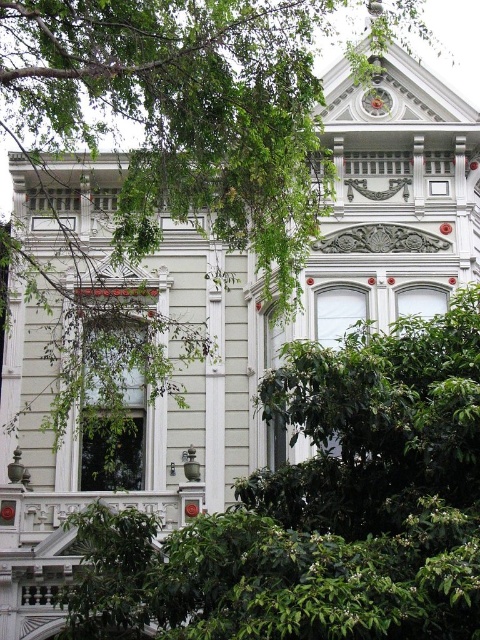
Question: Is the position of green leafy tree at left less distant than that of green leafy tree at center?

Choices:
 (A) no
 (B) yes

Answer: (B)

Question: From the image, what is the correct spatial relationship of green leafy tree at left in relation to metallic clock at upper center?

Choices:
 (A) left
 (B) right

Answer: (A)

Question: Which is farther from the green leafy tree at center?

Choices:
 (A) metallic clock at upper center
 (B) green leafy tree at left

Answer: (A)

Question: Is green leafy tree at left wider than green leafy tree at center?

Choices:
 (A) yes
 (B) no

Answer: (B)

Question: Which point is farther to the camera?

Choices:
 (A) (373, 115)
 (B) (153, 225)

Answer: (A)

Question: Which of the following is the closest to the observer?

Choices:
 (A) (154, 97)
 (B) (383, 92)

Answer: (A)